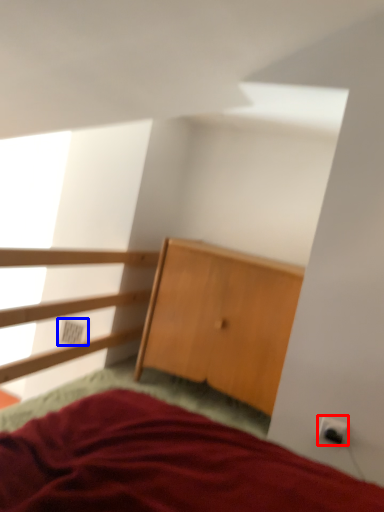
Question: Which object appears closest to the camera in this image, electric outlet (highlighted by a red box) or electric outlet (highlighted by a blue box)?

Choices:
 (A) electric outlet
 (B) electric outlet

Answer: (A)